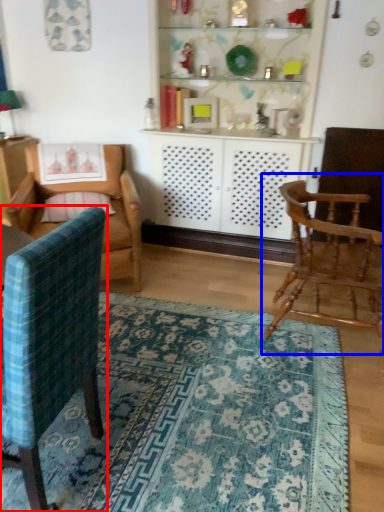
Question: Which point is further to the camera, chair (highlighted by a red box) or chair (highlighted by a blue box)?

Choices:
 (A) chair
 (B) chair

Answer: (B)